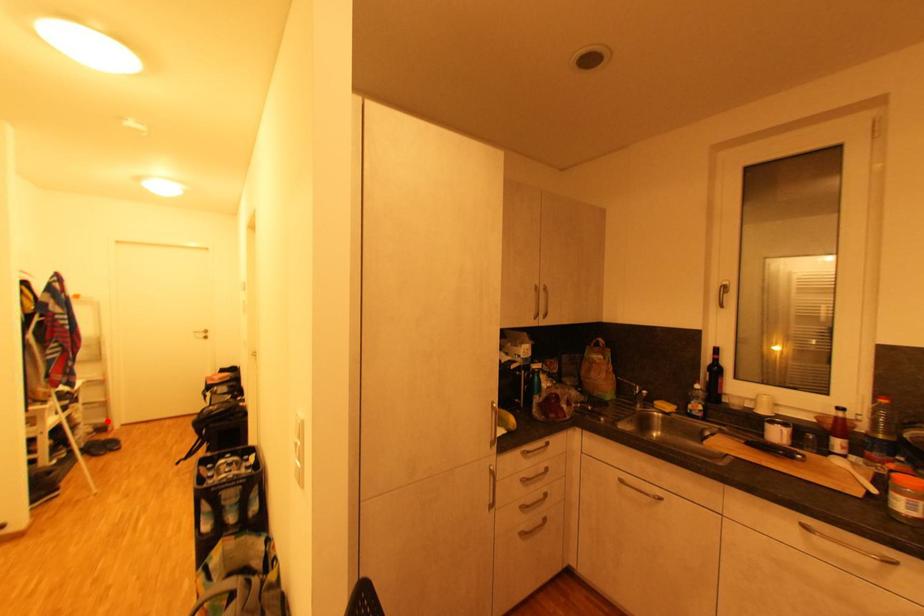
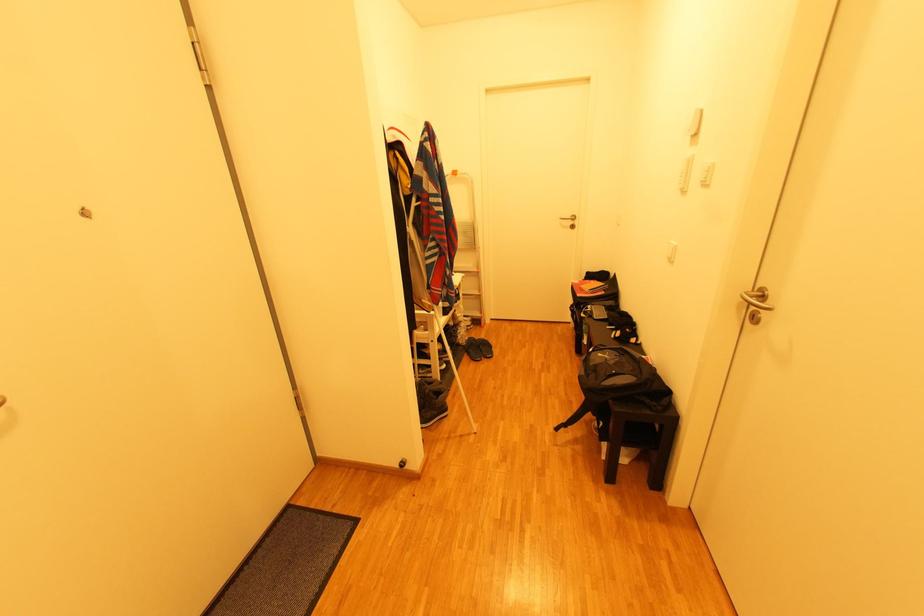
Question: I am providing you with two images of the same scene from different viewpoints. In image1, a red point is highlighted. Considering the same 3D point in image2, which of the following is correct?

Choices:
 (A) It is closer
 (B) It is farther

Answer: (A)